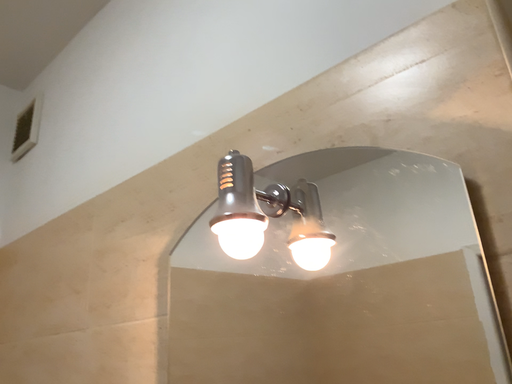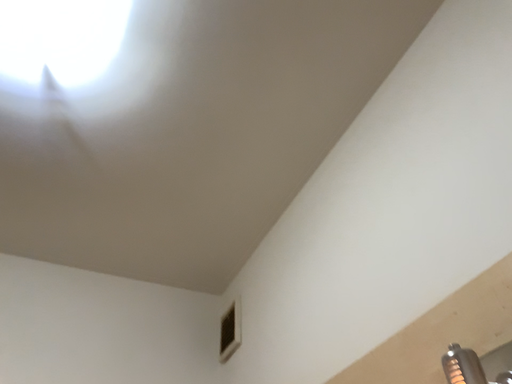
Question: Which way did the camera rotate in the video?

Choices:
 (A) rotated left
 (B) rotated right

Answer: (A)